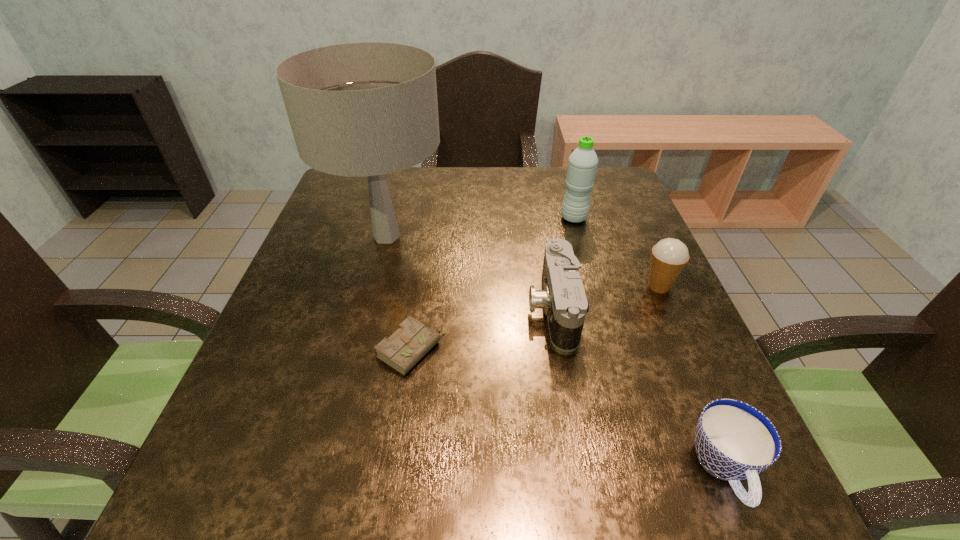
Where is `water bottle that is at the right edge`? water bottle that is at the right edge is located at coordinates (582, 165).

The height and width of the screenshot is (540, 960). I want to click on icecream at the right edge, so click(669, 256).

This screenshot has width=960, height=540. Find the location of `cup that is at the right edge`. cup that is at the right edge is located at coordinates (734, 441).

Locate an element on the screen. object present at the far left corner is located at coordinates (367, 109).

Locate an element on the screen. object that is positioned at the far right corner is located at coordinates (582, 165).

Where is `object that is at the near right corner`? The width and height of the screenshot is (960, 540). object that is at the near right corner is located at coordinates (734, 441).

This screenshot has width=960, height=540. In the image, there is a desktop. In order to click on free space at the far edge in this screenshot , I will do `click(448, 205)`.

In the image, there is a desktop. At what (x,y) coordinates should I click in order to perform the action: click on vacant area at the near edge. Please return your answer as a coordinate pair (x, y). Image resolution: width=960 pixels, height=540 pixels. Looking at the image, I should click on (377, 519).

Where is `vacant space at the left edge of the desktop`? This screenshot has width=960, height=540. vacant space at the left edge of the desktop is located at coordinates (365, 248).

The image size is (960, 540). I want to click on vacant area at the right edge of the desktop, so pyautogui.click(x=608, y=237).